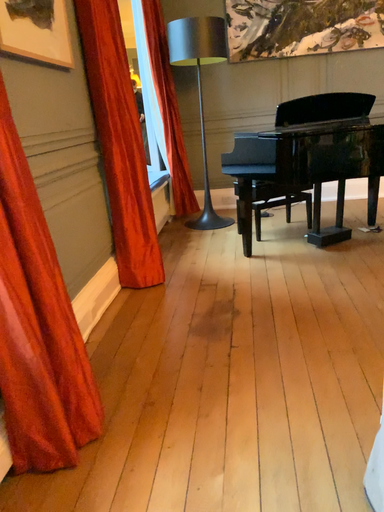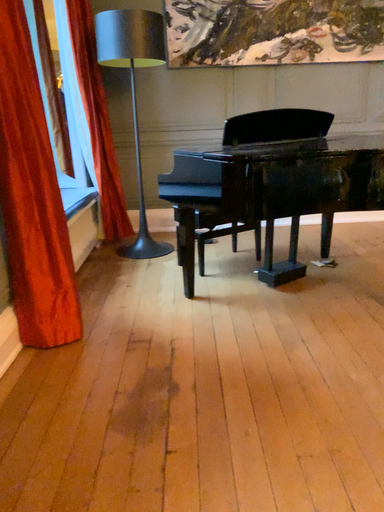
Question: How did the camera likely rotate when shooting the video?

Choices:
 (A) rotated right
 (B) rotated left

Answer: (A)